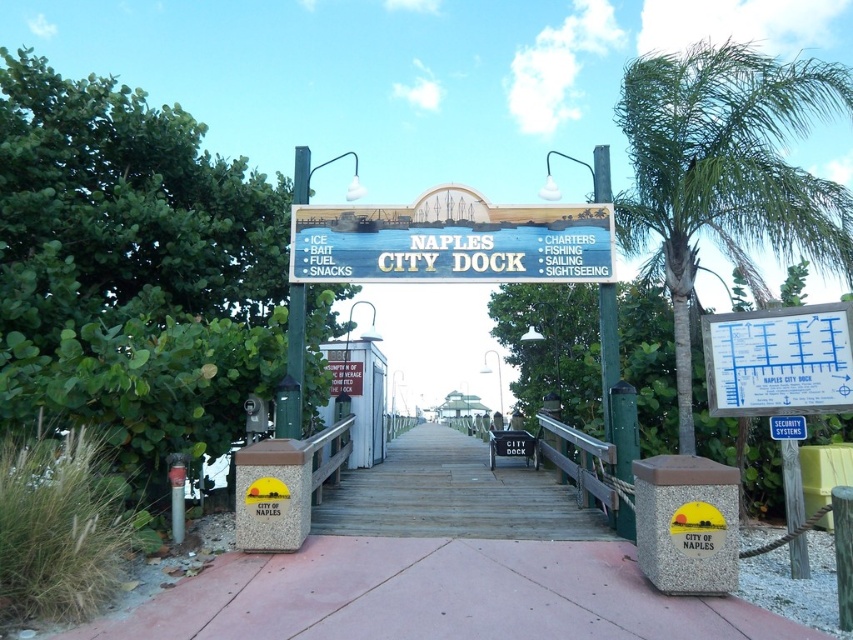
Does concrete at center appear on the left side of green leafy palm tree at right?

Indeed, concrete at center is positioned on the left side of green leafy palm tree at right.

Between concrete at center and green leafy palm tree at right, which one is positioned higher?

green leafy palm tree at right is above.

Which is in front, point (183, 612) or point (793, 65)?

Positioned in front is point (183, 612).

Locate an element on the screen. concrete at center is located at coordinates (463, 568).

Is point (695, 156) positioned after point (386, 278)?

That is True.

Is green leafy palm tree at right bigger than wooden signboard at center?

Yes.

Who is more forward, (691,88) or (376,276)?

Point (376,276)

This screenshot has width=853, height=640. Find the location of `green leafy palm tree at right`. green leafy palm tree at right is located at coordinates (726, 172).

Who is more distant from viewer, (476,221) or (601,156)?

The point (601,156) is more distant.

Does wooden signboard at center have a smaller size compared to green wooden signpost at center?

Actually, wooden signboard at center might be larger than green wooden signpost at center.

The height and width of the screenshot is (640, 853). Find the location of `wooden signboard at center`. wooden signboard at center is located at coordinates (451, 241).

This screenshot has height=640, width=853. Find the location of `wooden signboard at center`. wooden signboard at center is located at coordinates (451, 241).